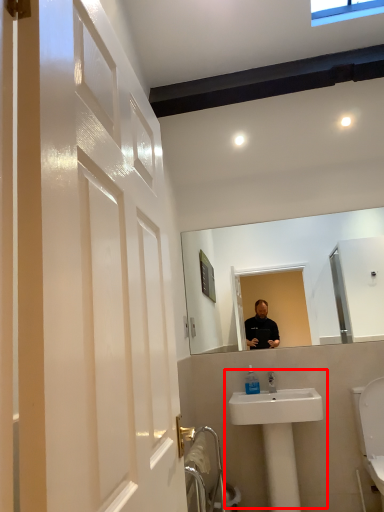
Question: From the image's perspective, what is the correct spatial positioning of sink (annotated by the red box) in reference to toiletry?

Choices:
 (A) above
 (B) below

Answer: (B)